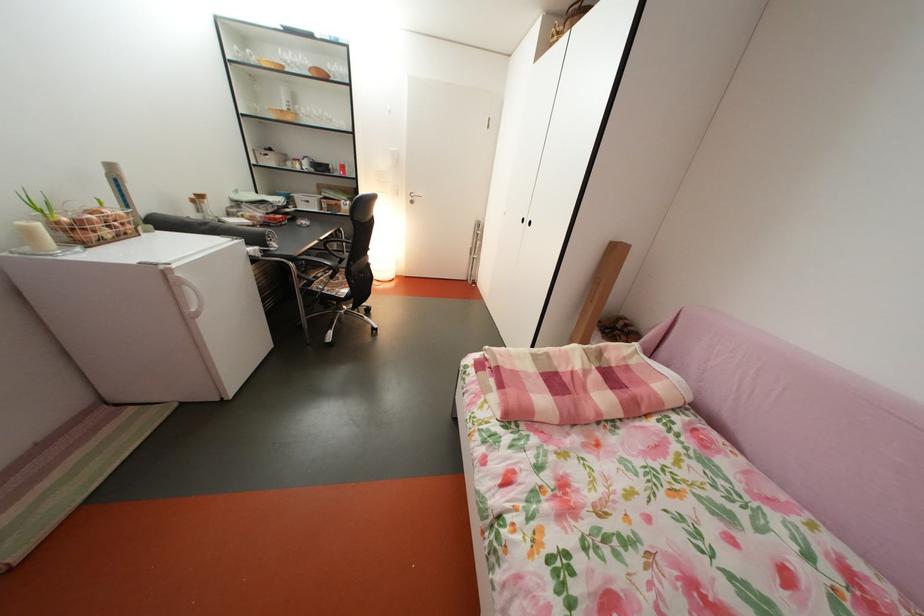
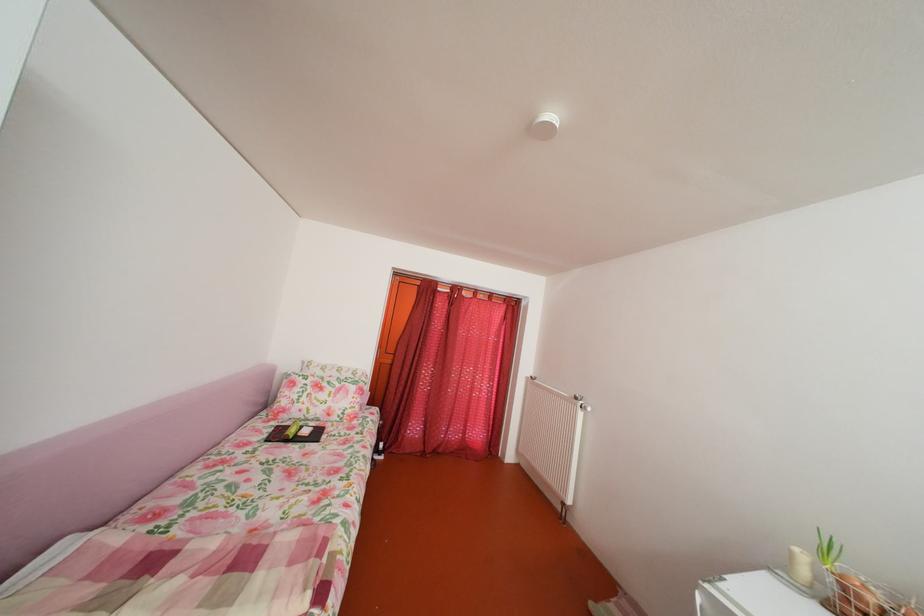
The point at (41,238) is marked in the first image. Where is the corresponding point in the second image?

(803, 561)